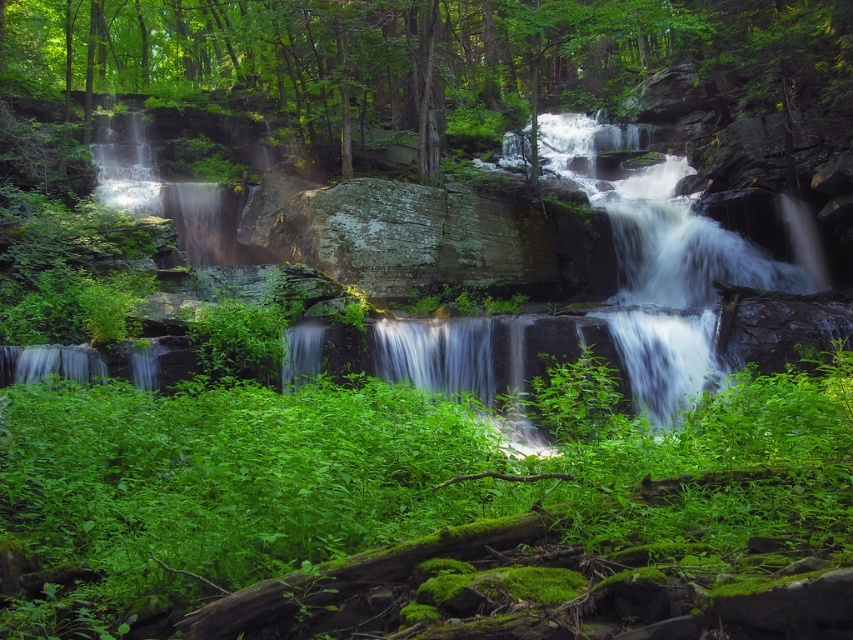
Question: Which of the following is the farthest from the observer?

Choices:
 (A) green leafy tree at upper center
 (B) green leafy plants at center

Answer: (A)

Question: In this image, where is green leafy plants at center located relative to green leafy tree at upper center?

Choices:
 (A) left
 (B) right

Answer: (B)

Question: Can you confirm if green leafy plants at center is thinner than green leafy tree at upper center?

Choices:
 (A) no
 (B) yes

Answer: (B)

Question: Which of the following is the closest to the observer?

Choices:
 (A) (480, 145)
 (B) (621, 435)

Answer: (B)

Question: Can you confirm if green leafy plants at center is positioned above green leafy tree at upper center?

Choices:
 (A) yes
 (B) no

Answer: (B)

Question: Which point is farther to the camera?

Choices:
 (A) green leafy tree at upper center
 (B) green leafy plants at center

Answer: (A)